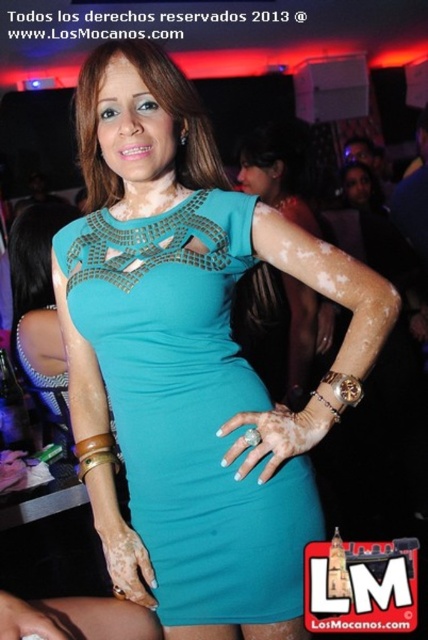
Question: Does teal jersey dress at center have a lesser width compared to teal fabric dress at center?

Choices:
 (A) yes
 (B) no

Answer: (B)

Question: Which object appears closest to the camera in this image?

Choices:
 (A) teal fabric dress at center
 (B) teal jersey dress at center

Answer: (B)

Question: Can you confirm if teal jersey dress at center is thinner than teal fabric dress at center?

Choices:
 (A) yes
 (B) no

Answer: (B)

Question: Is the position of teal jersey dress at center more distant than that of teal fabric dress at center?

Choices:
 (A) no
 (B) yes

Answer: (A)